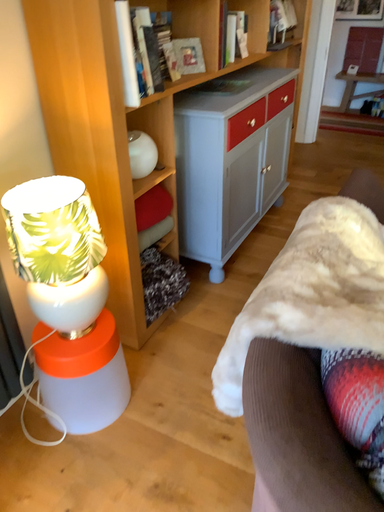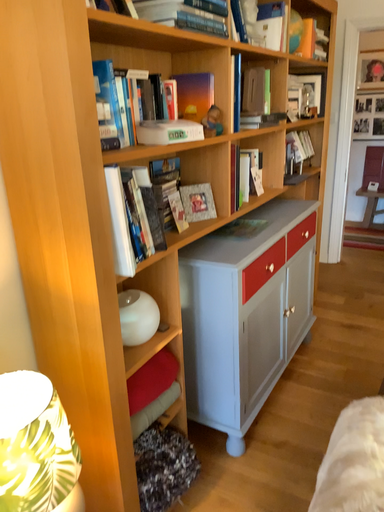
Question: How did the camera likely rotate when shooting the video?

Choices:
 (A) rotated upward
 (B) rotated downward

Answer: (A)